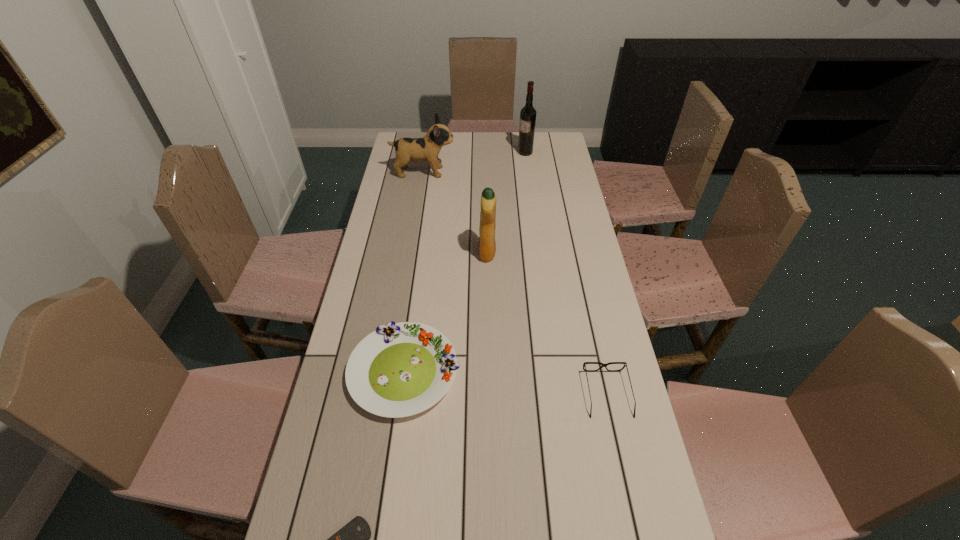
I want to click on the farthest object, so click(x=528, y=113).

The width and height of the screenshot is (960, 540). In order to click on the tallest object in this screenshot , I will do `click(528, 113)`.

Locate an element on the screen. Image resolution: width=960 pixels, height=540 pixels. the fourth object from left to right is located at coordinates (487, 247).

Locate an element on the screen. This screenshot has height=540, width=960. detergent is located at coordinates (487, 247).

I want to click on the fifth nearest object, so click(427, 148).

Identify the location of the rightmost object. (625, 364).

At what (x,y) coordinates should I click in order to perform the action: click on salad plate. Please return your answer as a coordinate pair (x, y). The height and width of the screenshot is (540, 960). Looking at the image, I should click on (401, 369).

Locate an element on the screen. The width and height of the screenshot is (960, 540). vacant space positioned on the front and back of the tallest object is located at coordinates (431, 152).

At what (x,y) coordinates should I click in order to perform the action: click on free space located 0.390m on the front and back of the tallest object. Please return your answer as a coordinate pair (x, y). The height and width of the screenshot is (540, 960). Looking at the image, I should click on (433, 152).

Where is `free region located on the front and back of the tallest object`? free region located on the front and back of the tallest object is located at coordinates (485, 152).